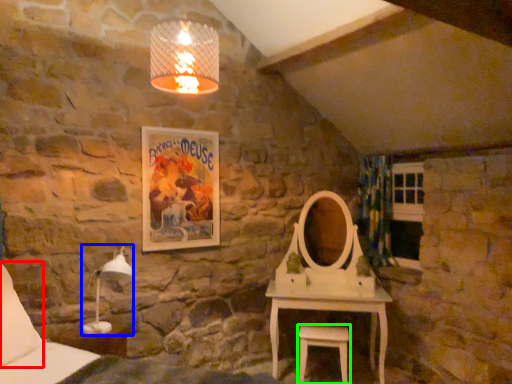
Question: Which is farther away from pillow (highlighted by a red box)? table lamp (highlighted by a blue box) or stool (highlighted by a green box)?

Choices:
 (A) table lamp
 (B) stool

Answer: (B)